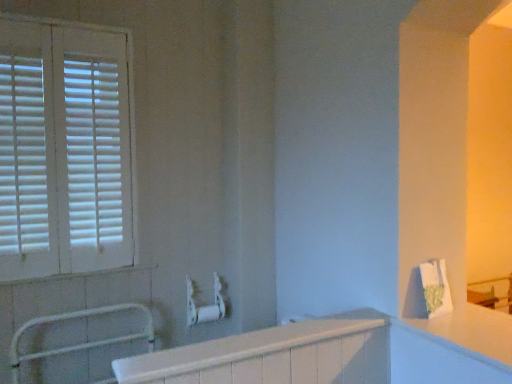
Question: Is white glossy bathtub at center at the left side of white glossy countertop at right?

Choices:
 (A) no
 (B) yes

Answer: (B)

Question: Is white glossy bathtub at center surrounding white glossy countertop at right?

Choices:
 (A) yes
 (B) no

Answer: (B)

Question: Is white glossy bathtub at center closer to the viewer compared to white glossy countertop at right?

Choices:
 (A) yes
 (B) no

Answer: (A)

Question: Can you confirm if white glossy bathtub at center is thinner than white glossy countertop at right?

Choices:
 (A) no
 (B) yes

Answer: (B)

Question: Is the position of white glossy bathtub at center more distant than that of white glossy countertop at right?

Choices:
 (A) yes
 (B) no

Answer: (B)

Question: Is white glossy bathtub at center completely or partially outside of white glossy countertop at right?

Choices:
 (A) no
 (B) yes

Answer: (B)

Question: Considering the relative sizes of white matte metal balustrade at lower left and white wooden blinds at left in the image provided, is white matte metal balustrade at lower left thinner than white wooden blinds at left?

Choices:
 (A) yes
 (B) no

Answer: (B)

Question: Is white matte metal balustrade at lower left smaller than white wooden blinds at left?

Choices:
 (A) no
 (B) yes

Answer: (B)

Question: Does white matte metal balustrade at lower left lie behind white wooden blinds at left?

Choices:
 (A) yes
 (B) no

Answer: (B)

Question: From the image's perspective, is white matte metal balustrade at lower left on top of white wooden blinds at left?

Choices:
 (A) yes
 (B) no

Answer: (B)

Question: Is white matte metal balustrade at lower left at the left side of white wooden blinds at left?

Choices:
 (A) yes
 (B) no

Answer: (B)

Question: Would you say white wooden blinds at left is part of white matte metal balustrade at lower left's contents?

Choices:
 (A) yes
 (B) no

Answer: (B)

Question: Is white wooden blinds at left closer to the viewer compared to white matte metal balustrade at lower left?

Choices:
 (A) yes
 (B) no

Answer: (B)